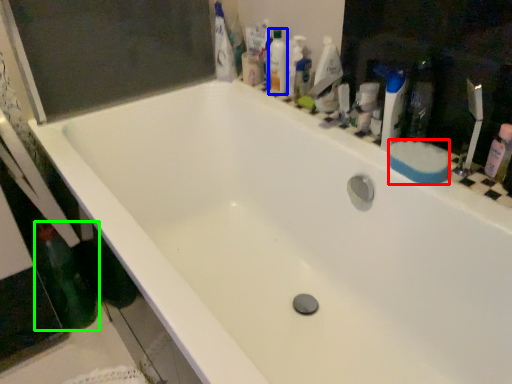
Question: Which object is the closest to the soap (highlighted by a red box)? Choose among these: mouthwash (highlighted by a blue box) or bottle (highlighted by a green box).

Choices:
 (A) mouthwash
 (B) bottle

Answer: (A)